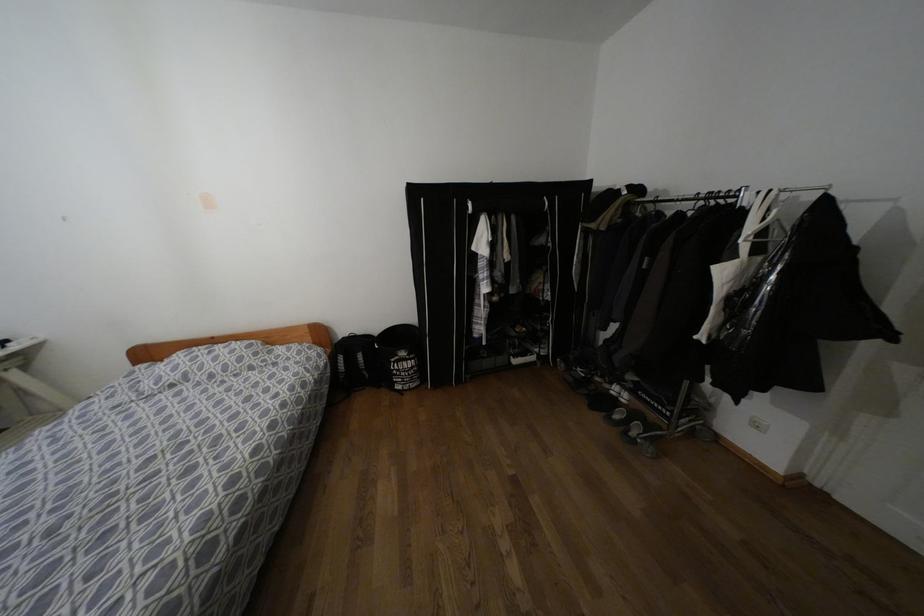
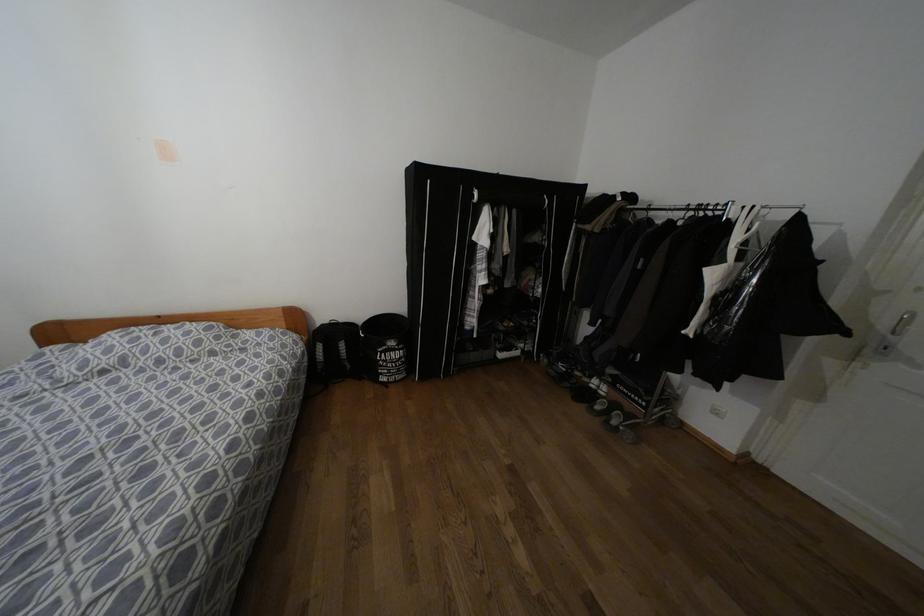
Find the pixel in the second image that matches [359,355] in the first image.

(342, 345)